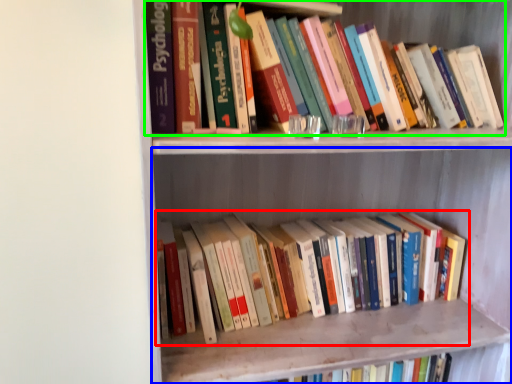
Question: Estimate the real-world distances between objects in this image. Which object is closer to book (highlighted by a red box), shelf (highlighted by a blue box) or book (highlighted by a green box)?

Choices:
 (A) shelf
 (B) book

Answer: (A)